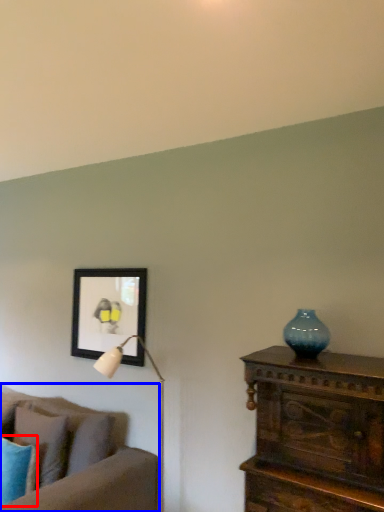
Question: Among these objects, which one is nearest to the camera, pillow (highlighted by a red box) or studio couch (highlighted by a blue box)?

Choices:
 (A) pillow
 (B) studio couch

Answer: (B)